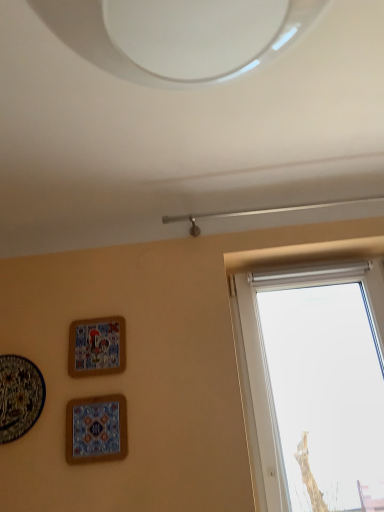
Question: Can you confirm if matte ceramic picture frame at upper left, placed as the 2th picture frame when sorted from right to left, is thinner than matte ceramic plate at lower left, acting as the 3th picture frame starting from the right?

Choices:
 (A) no
 (B) yes

Answer: (B)

Question: Is matte ceramic picture frame at upper left, placed as the 2th picture frame when sorted from right to left, taller than matte ceramic plate at lower left, acting as the 3th picture frame starting from the right?

Choices:
 (A) no
 (B) yes

Answer: (A)

Question: From a real-world perspective, is matte ceramic picture frame at upper left, placed as the 2th picture frame when sorted from right to left, over matte ceramic plate at lower left, the 1th picture frame from the left?

Choices:
 (A) yes
 (B) no

Answer: (A)

Question: Are matte ceramic picture frame at upper left, placed as the 2th picture frame when sorted from right to left, and matte ceramic plate at lower left, acting as the 3th picture frame starting from the right, making contact?

Choices:
 (A) no
 (B) yes

Answer: (A)

Question: Is matte ceramic picture frame at upper left, positioned as the second picture frame in left-to-right order, not near matte ceramic plate at lower left, acting as the 3th picture frame starting from the right?

Choices:
 (A) no
 (B) yes

Answer: (A)

Question: In the image, is matte ceramic plate at lower left, the 1th picture frame from the left, positioned in front of or behind matte ceramic picture frame at upper left, positioned as the second picture frame in left-to-right order?

Choices:
 (A) behind
 (B) front

Answer: (B)

Question: Does point (38, 385) appear closer or farther from the camera than point (112, 331)?

Choices:
 (A) closer
 (B) farther

Answer: (A)

Question: From a real-world perspective, relative to matte ceramic picture frame at upper left, placed as the 2th picture frame when sorted from right to left, is matte ceramic plate at lower left, acting as the 3th picture frame starting from the right, vertically above or below?

Choices:
 (A) below
 (B) above

Answer: (A)

Question: In terms of height, does matte ceramic plate at lower left, the 1th picture frame from the left, look taller or shorter compared to matte ceramic picture frame at upper left, positioned as the second picture frame in left-to-right order?

Choices:
 (A) short
 (B) tall

Answer: (B)

Question: Is matte ceramic tile at lower left, marked as the first picture frame in a right-to-left arrangement, taller or shorter than matte ceramic picture frame at upper left, placed as the 2th picture frame when sorted from right to left?

Choices:
 (A) tall
 (B) short

Answer: (B)

Question: Is matte ceramic tile at lower left, marked as the first picture frame in a right-to-left arrangement, bigger or smaller than matte ceramic picture frame at upper left, placed as the 2th picture frame when sorted from right to left?

Choices:
 (A) big
 (B) small

Answer: (B)

Question: Considering the positions of matte ceramic tile at lower left, the 3th picture frame positioned from the left, and matte ceramic picture frame at upper left, positioned as the second picture frame in left-to-right order, in the image, is matte ceramic tile at lower left, the 3th picture frame positioned from the left, wider or thinner than matte ceramic picture frame at upper left, positioned as the second picture frame in left-to-right order,?

Choices:
 (A) wide
 (B) thin

Answer: (B)

Question: Is point (82, 398) closer or farther from the camera than point (76, 332)?

Choices:
 (A) farther
 (B) closer

Answer: (B)

Question: In terms of height, does matte ceramic plate at lower left, the 1th picture frame from the left, look taller or shorter compared to matte ceramic tile at lower left, the 3th picture frame positioned from the left?

Choices:
 (A) short
 (B) tall

Answer: (B)

Question: Visually, is matte ceramic plate at lower left, the 1th picture frame from the left, positioned to the left or to the right of matte ceramic tile at lower left, the 3th picture frame positioned from the left?

Choices:
 (A) right
 (B) left

Answer: (B)